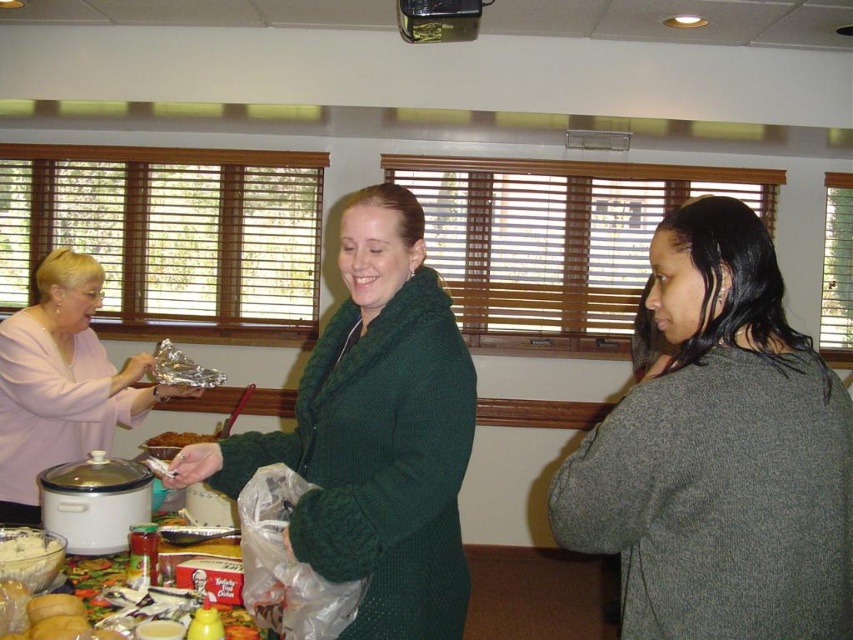
You are a photographer at the event and need to capture a photo that includes both the gray wool sweater at right and the green knitted sweater at center. Based on their positions, which sweater should you focus on first to ensure both are in frame?

The gray wool sweater at right is above the green knitted sweater at center, so focusing on the gray wool sweater at right first will ensure both are within the frame.

You are at a potluck event and need to place a tall centerpiece on the table. The matte pink sweater at left and the plastic tableware at lower left are on the table. Which object can you use as a base to elevate the centerpiece?

The matte pink sweater at left is taller than the plastic tableware at lower left, so it can be used as a base to elevate the centerpiece.

In the scene shown: You are standing at the point labeled point [413,506] and want to walk to the point labeled point [170,548]. Which direction should you move to get closer to your destination?

To move from point [413,506] to point [170,548], you should move downward and to the right since point [170,548] is behind point [413,506].